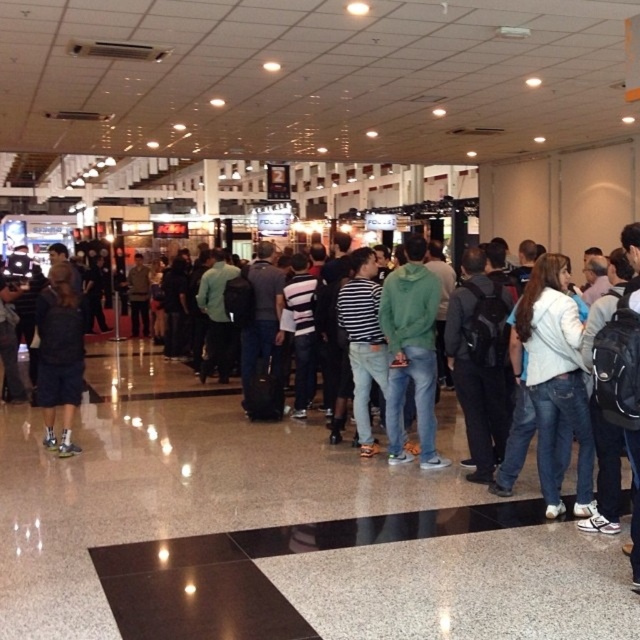
Find the location of a particular element. This screenshot has width=640, height=640. white cotton jacket at right is located at coordinates (556, 378).

Is point (568, 321) more distant than point (70, 275)?

No, it is in front of (70, 275).

Identify the location of white cotton jacket at right. The image size is (640, 640). (556, 378).